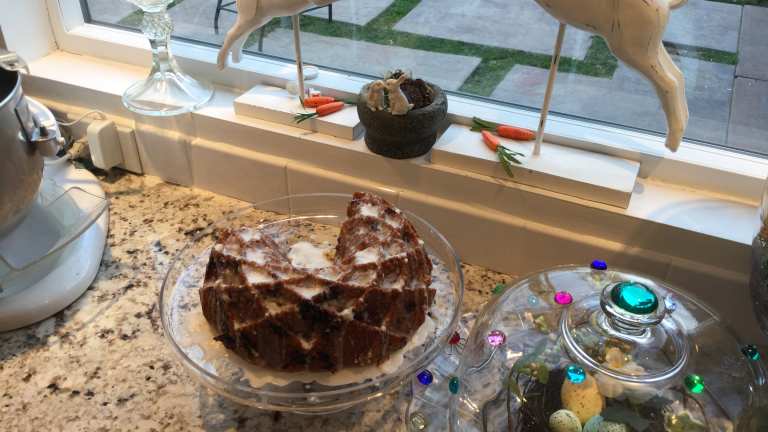
Locate an element on the screen. This screenshot has height=432, width=768. cake stand is located at coordinates (300, 391).